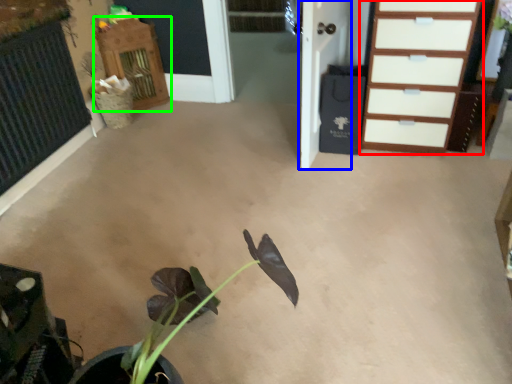
Question: Based on their relative distances, which object is nearer to chest of drawers (highlighted by a red box)? Choose from door (highlighted by a blue box) and dresser (highlighted by a green box).

Choices:
 (A) door
 (B) dresser

Answer: (A)